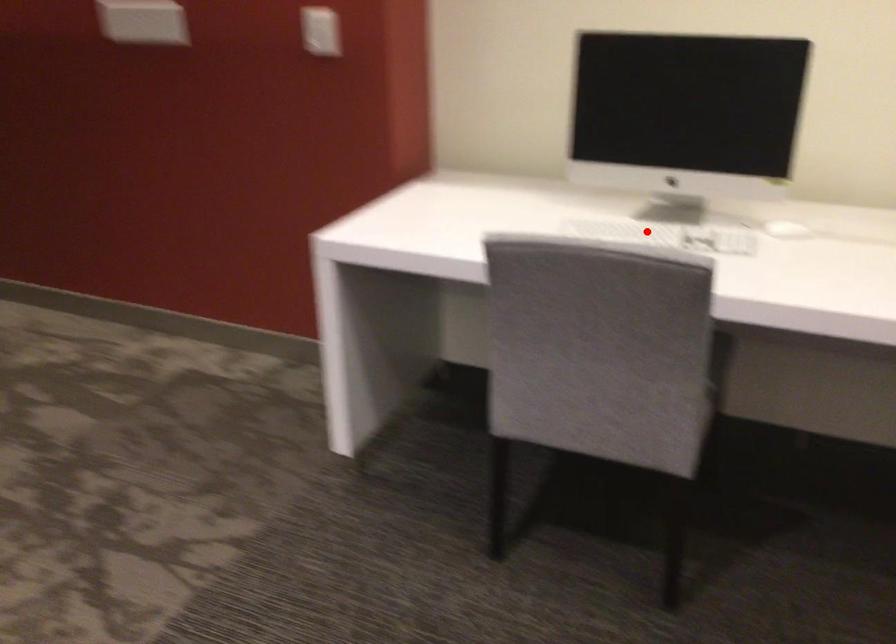
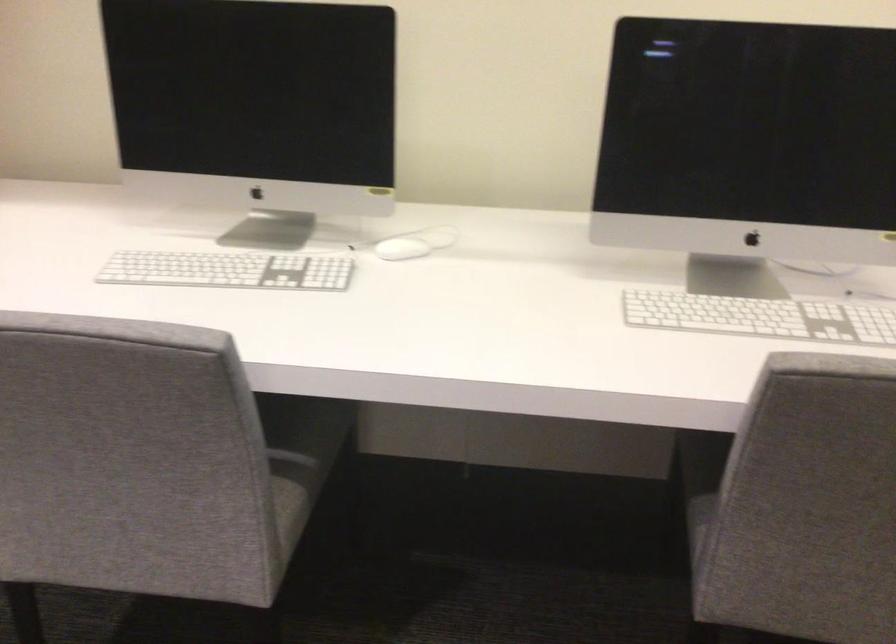
Locate, in the second image, the point that corresponds to the highlighted location in the first image.

(228, 270)